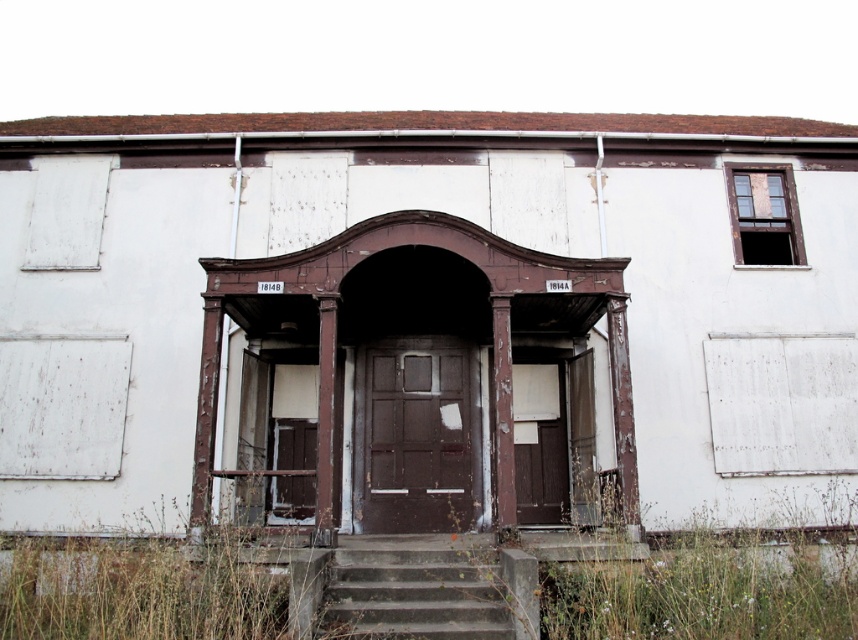
You are standing at the entrance of the old building and want to walk towards the brown grass at lower left. What direction should you move in?

The brown grass at lower left is located at coordinates point (144, 588), so you should move towards the lower left direction to reach it.

You are standing in front of the old building and want to enter through the entrance. Where exactly should you go to find the brown matte door at center?

The brown matte door at center is located at the coordinates point (x=414, y=436), so you should go to that exact point to find it.